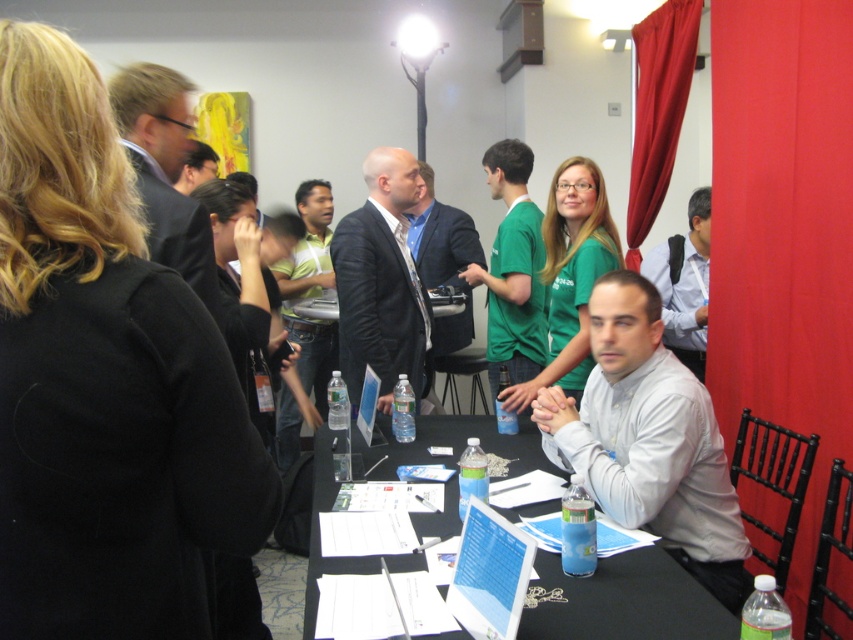
Is black plastic table at center to the left of red velvet curtain at upper right from the viewer's perspective?

Yes, black plastic table at center is to the left of red velvet curtain at upper right.

Does black plastic table at center have a smaller size compared to red velvet curtain at upper right?

No, black plastic table at center is not smaller than red velvet curtain at upper right.

Image resolution: width=853 pixels, height=640 pixels. Find the location of `black plastic table at center`. black plastic table at center is located at coordinates (625, 602).

Which of these two, black suit at center or red velvet curtain at upper right, stands taller?

red velvet curtain at upper right is taller.

Describe the element at coordinates (380, 280) in the screenshot. This screenshot has height=640, width=853. I see `black suit at center` at that location.

Where is `black suit at center`? This screenshot has height=640, width=853. black suit at center is located at coordinates (380, 280).

Does green fabric shirt at center have a smaller size compared to white shirt at right?

Actually, green fabric shirt at center might be larger than white shirt at right.

Between point (521, 372) and point (704, 321), which one is positioned behind?

The point (704, 321) is behind.

Locate an element on the screen. This screenshot has height=640, width=853. green fabric shirt at center is located at coordinates (514, 269).